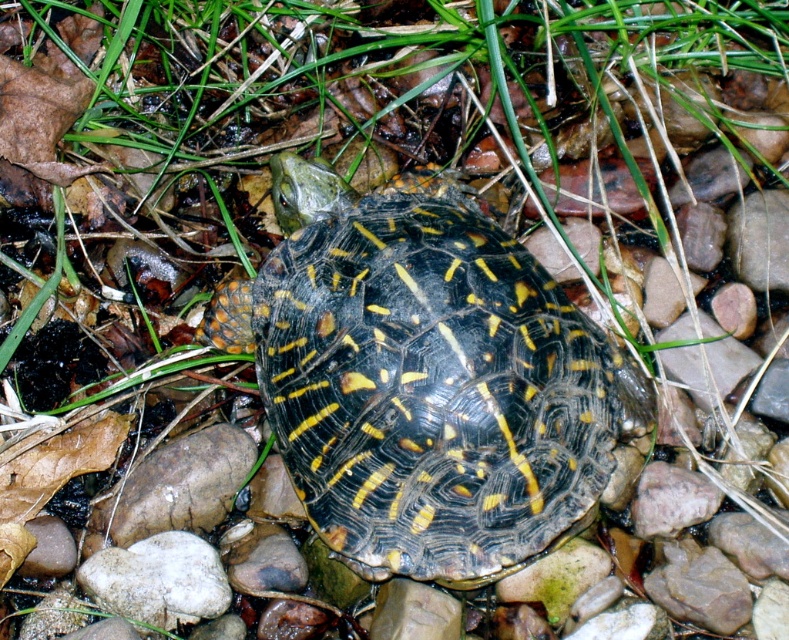
Question: Is yellow-patterned shell at center to the left of smooth gray rock at center from the viewer's perspective?

Choices:
 (A) no
 (B) yes

Answer: (A)

Question: Observing the image, what is the correct spatial positioning of yellow-patterned shell at center in reference to smooth gray rock at center?

Choices:
 (A) right
 (B) left

Answer: (A)

Question: Does yellow-patterned shell at center lie behind smooth gray rock at center?

Choices:
 (A) yes
 (B) no

Answer: (B)

Question: Among these objects, which one is farthest from the camera?

Choices:
 (A) smooth gray rock at center
 (B) yellow-patterned shell at center

Answer: (A)